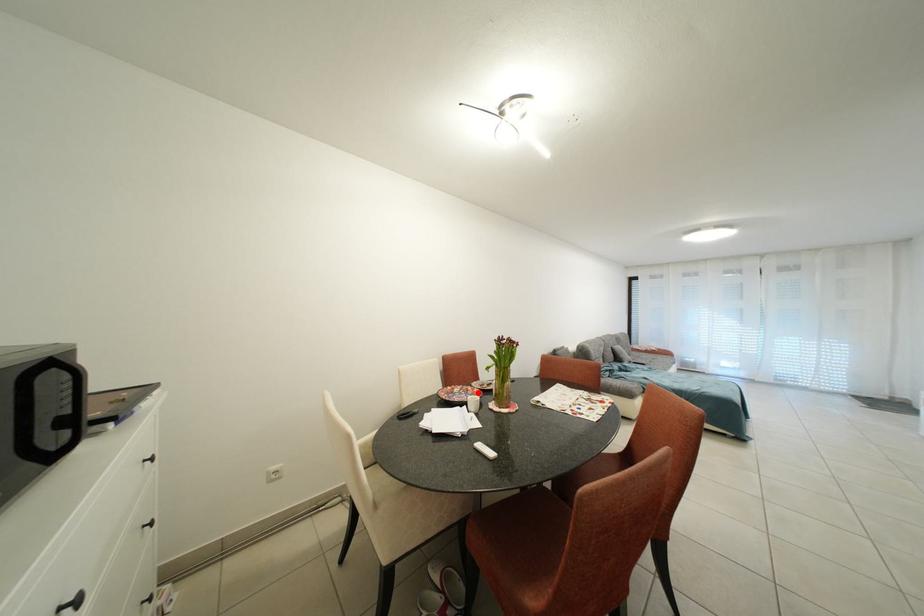
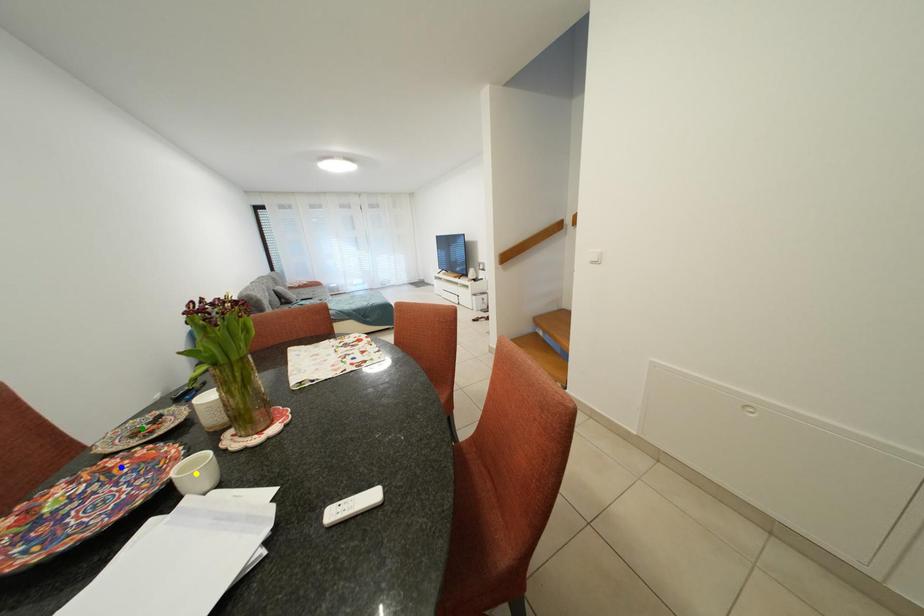
Question: I am providing you with two images of the same scene from different viewpoints. A red point is marked on the first image. You are given multiple points on the second image. Which point in image 2 represents the same 3d spot as the red point in image 1?

Choices:
 (A) blue point
 (B) green point
 (C) yellow point

Answer: (A)